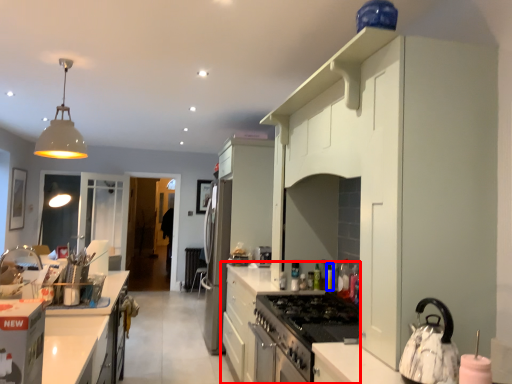
Question: Which point is further to the camera, cabinetry (highlighted by a red box) or bottle (highlighted by a blue box)?

Choices:
 (A) cabinetry
 (B) bottle

Answer: (B)